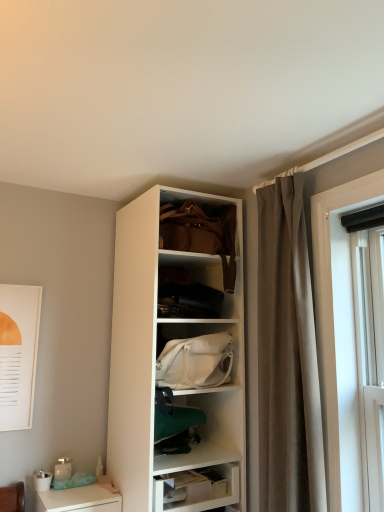
Describe the element at coordinates (287, 356) in the screenshot. I see `brown fabric curtain at right` at that location.

The height and width of the screenshot is (512, 384). In order to click on white fabric handbag at center, the first handbag from the bottom in this screenshot , I will do `click(196, 362)`.

The image size is (384, 512). In order to click on white glossy desk at lower left in this screenshot , I will do click(x=78, y=500).

Between brown fabric curtain at right and leather handbag at upper center, arranged as the first handbag when viewed from the top, which one has smaller size?

With smaller size is leather handbag at upper center, arranged as the first handbag when viewed from the top.

Is leather handbag at upper center, marked as the 2th handbag in a bottom-to-top arrangement, inside brown fabric curtain at right?

No, leather handbag at upper center, marked as the 2th handbag in a bottom-to-top arrangement, is not a part of brown fabric curtain at right.

Which point is more forward, (297, 316) or (224, 267)?

The point (297, 316) is closer.

Is white fabric handbag at center, the first handbag from the bottom, next to brown fabric curtain at right and touching it?

No, white fabric handbag at center, the first handbag from the bottom, is not beside brown fabric curtain at right.

Can you confirm if white fabric handbag at center, the first handbag from the bottom, is smaller than brown fabric curtain at right?

Yes.

Is white fabric handbag at center, the first handbag from the bottom, looking in the opposite direction of brown fabric curtain at right?

No, white fabric handbag at center, the first handbag from the bottom,'s orientation is not away from brown fabric curtain at right.

In terms of width, does white fabric handbag at center, arranged as the 2th handbag when viewed from the top, look wider or thinner when compared to brown fabric curtain at right?

Considering their sizes, white fabric handbag at center, arranged as the 2th handbag when viewed from the top, looks broader than brown fabric curtain at right.

In terms of size, does white fabric handbag at center, the first handbag from the bottom, appear bigger or smaller than white glossy desk at lower left?

Considering their sizes, white fabric handbag at center, the first handbag from the bottom, takes up more space than white glossy desk at lower left.

Between white fabric handbag at center, arranged as the 2th handbag when viewed from the top, and white glossy desk at lower left, which one has smaller width?

Thinner between the two is white fabric handbag at center, arranged as the 2th handbag when viewed from the top.

Would you say white fabric handbag at center, the first handbag from the bottom, contains white glossy desk at lower left?

Definitely not — white glossy desk at lower left is not inside white fabric handbag at center, the first handbag from the bottom.

From a real-world perspective, is white fabric handbag at center, the first handbag from the bottom, under white glossy desk at lower left?

No.

Considering the positions of points (224, 240) and (227, 354), is point (224, 240) closer to camera compared to point (227, 354)?

No, (224, 240) is behind (227, 354).

In order to click on handbag above the white fabric handbag at center, the first handbag from the bottom (from a real-world perspective) in this screenshot , I will do tap(201, 234).

Is leather handbag at upper center, arranged as the first handbag when viewed from the top, not within white fabric handbag at center, the first handbag from the bottom?

Yes, leather handbag at upper center, arranged as the first handbag when viewed from the top, is outside of white fabric handbag at center, the first handbag from the bottom.

Considering the sizes of objects white glossy desk at lower left and brown fabric curtain at right in the image provided, who is smaller, white glossy desk at lower left or brown fabric curtain at right?

white glossy desk at lower left.

From the picture: Between white glossy desk at lower left and brown fabric curtain at right, which one has larger width?

With larger width is white glossy desk at lower left.

Does white glossy desk at lower left have a greater height compared to brown fabric curtain at right?

No.

Is white glossy desk at lower left inside the boundaries of brown fabric curtain at right, or outside?

white glossy desk at lower left lies outside brown fabric curtain at right.

How many degrees apart are the facing directions of leather handbag at upper center, marked as the 2th handbag in a bottom-to-top arrangement, and white glossy desk at lower left?

2.84 degrees.

Which is more to the left, leather handbag at upper center, marked as the 2th handbag in a bottom-to-top arrangement, or white glossy desk at lower left?

Positioned to the left is white glossy desk at lower left.

Does leather handbag at upper center, arranged as the first handbag when viewed from the top, have a lesser height compared to white glossy desk at lower left?

Incorrect, the height of leather handbag at upper center, arranged as the first handbag when viewed from the top, does not fall short of that of white glossy desk at lower left.

Is white glossy desk at lower left taller or shorter than leather handbag at upper center, marked as the 2th handbag in a bottom-to-top arrangement?

Considering their sizes, white glossy desk at lower left has less height than leather handbag at upper center, marked as the 2th handbag in a bottom-to-top arrangement.

How distant is white glossy desk at lower left from leather handbag at upper center, arranged as the first handbag when viewed from the top?

white glossy desk at lower left and leather handbag at upper center, arranged as the first handbag when viewed from the top, are 4.20 feet apart from each other.

Does point (107, 492) appear closer or farther from the camera than point (164, 221)?

Point (107, 492) is positioned closer to the camera compared to point (164, 221).

Locate an element on the screen. This screenshot has height=512, width=384. the 1st handbag counting from the left side of the brown fabric curtain at right is located at coordinates (201, 234).

Where is `curtain that is on the right side of white fabric handbag at center, the first handbag from the bottom`? The width and height of the screenshot is (384, 512). curtain that is on the right side of white fabric handbag at center, the first handbag from the bottom is located at coordinates (287, 356).

Based on their spatial positions, is white glossy desk at lower left or brown fabric curtain at right closer to white fabric handbag at center, the first handbag from the bottom?

brown fabric curtain at right is positioned closer to the anchor white fabric handbag at center, the first handbag from the bottom.

Based on the photo, which object lies nearer to the anchor point brown fabric curtain at right, white glossy desk at lower left or white fabric handbag at center, arranged as the 2th handbag when viewed from the top?

Based on the image, white fabric handbag at center, arranged as the 2th handbag when viewed from the top, appears to be nearer to brown fabric curtain at right.

Based on their spatial positions, is white glossy desk at lower left or brown fabric curtain at right further from leather handbag at upper center, marked as the 2th handbag in a bottom-to-top arrangement?

white glossy desk at lower left lies further to leather handbag at upper center, marked as the 2th handbag in a bottom-to-top arrangement, than the other object.

Consider the image. From the image, which object appears to be farther from leather handbag at upper center, marked as the 2th handbag in a bottom-to-top arrangement, brown fabric curtain at right or white glossy desk at lower left?

white glossy desk at lower left lies further to leather handbag at upper center, marked as the 2th handbag in a bottom-to-top arrangement, than the other object.

Based on their spatial positions, is brown fabric curtain at right or white fabric handbag at center, arranged as the 2th handbag when viewed from the top, closer to leather handbag at upper center, arranged as the first handbag when viewed from the top?

The object closer to leather handbag at upper center, arranged as the first handbag when viewed from the top, is brown fabric curtain at right.

Looking at the image, which one is located further to white glossy desk at lower left, brown fabric curtain at right or white fabric handbag at center, the first handbag from the bottom?

Among the two, brown fabric curtain at right is located further to white glossy desk at lower left.

Estimate the real-world distances between objects in this image. Which object is further from brown fabric curtain at right, white fabric handbag at center, the first handbag from the bottom, or white glossy desk at lower left?

white glossy desk at lower left.

Estimate the real-world distances between objects in this image. Which object is closer to brown fabric curtain at right, leather handbag at upper center, marked as the 2th handbag in a bottom-to-top arrangement, or white glossy desk at lower left?

leather handbag at upper center, marked as the 2th handbag in a bottom-to-top arrangement, lies closer to brown fabric curtain at right than the other object.

The height and width of the screenshot is (512, 384). I want to click on curtain between leather handbag at upper center, marked as the 2th handbag in a bottom-to-top arrangement, and white glossy desk at lower left vertically, so tap(287, 356).

The height and width of the screenshot is (512, 384). I want to click on curtain between leather handbag at upper center, arranged as the first handbag when viewed from the top, and white fabric handbag at center, arranged as the 2th handbag when viewed from the top, from top to bottom, so click(287, 356).

Locate an element on the screen. The image size is (384, 512). handbag between leather handbag at upper center, marked as the 2th handbag in a bottom-to-top arrangement, and white glossy desk at lower left in the up-down direction is located at coordinates (196, 362).